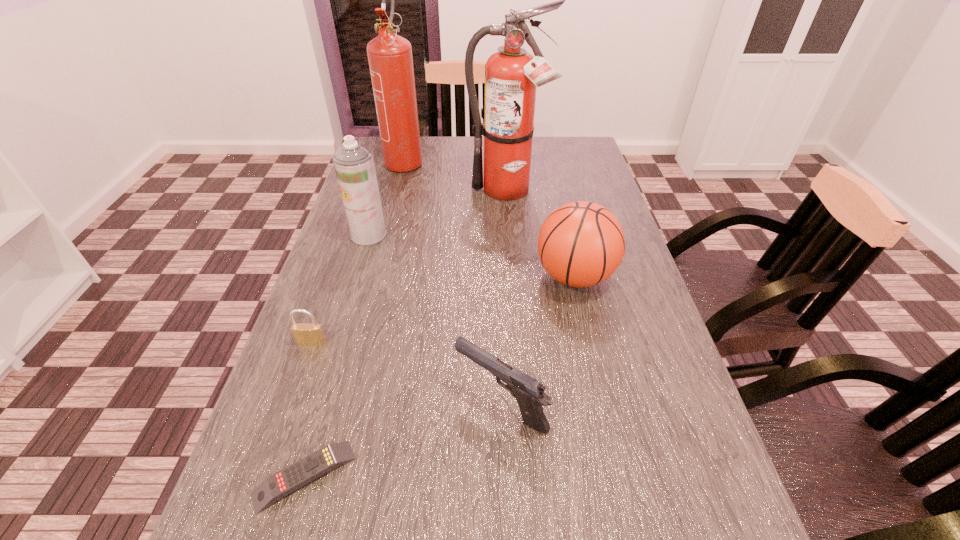
Where is `free space located 0.160m on the right of the remote control`? free space located 0.160m on the right of the remote control is located at coordinates (452, 476).

The width and height of the screenshot is (960, 540). What are the coordinates of `object at the far edge` in the screenshot? It's located at (390, 59).

Image resolution: width=960 pixels, height=540 pixels. I want to click on fire extinguisher that is positioned at the left edge, so click(x=390, y=59).

Image resolution: width=960 pixels, height=540 pixels. I want to click on aerosol can that is at the left edge, so click(354, 165).

Identify the location of padlock that is at the left edge. (304, 333).

Identify the location of remote control present at the left edge. The image size is (960, 540). (298, 474).

Where is `object that is at the right edge`? The height and width of the screenshot is (540, 960). object that is at the right edge is located at coordinates (581, 244).

Identify the location of object located at the far left corner. (390, 59).

Find the location of a particular element. This screenshot has height=540, width=960. vacant space at the far edge is located at coordinates (466, 159).

In the image, there is a desktop. In order to click on vacant space at the left edge in this screenshot , I will do `click(245, 475)`.